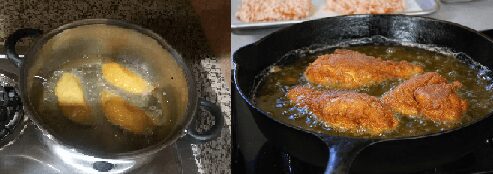
Where is `counter`? counter is located at coordinates (472, 12).